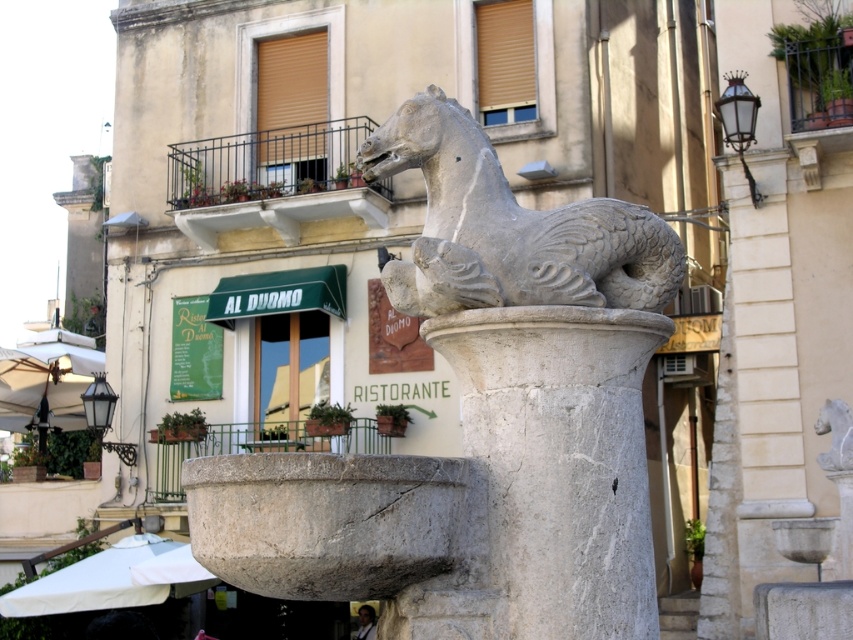
Question: Considering the real-world distances, which object is farthest from the white marble horse at center?

Choices:
 (A) gray stone horse at center
 (B) white marble pillar at center

Answer: (A)

Question: Does white marble horse at center have a greater width compared to white marble pillar at center?

Choices:
 (A) yes
 (B) no

Answer: (B)

Question: Which object is farther from the camera taking this photo?

Choices:
 (A) white marble pillar at center
 (B) gray stone horse at center

Answer: (B)

Question: Observing the image, what is the correct spatial positioning of white marble pillar at center in reference to gray stone horse at center?

Choices:
 (A) below
 (B) above

Answer: (A)

Question: Does white marble horse at center have a lesser width compared to white marble pillar at center?

Choices:
 (A) yes
 (B) no

Answer: (A)

Question: Which of these objects is positioned farthest from the white marble pillar at center?

Choices:
 (A) white marble horse at center
 (B) gray stone horse at center

Answer: (A)